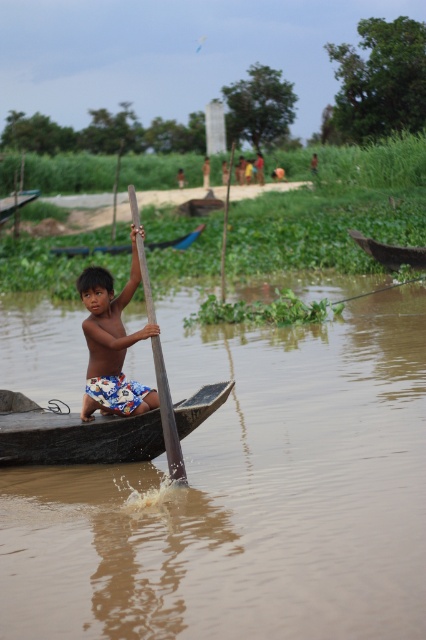
You are a passenger in the brown wooden boat at center and dark brown wood canoe at center. Which vessel is currently above the other?

The brown wooden boat at center is positioned over dark brown wood canoe at center, so the brown wooden boat at center is above the dark brown wood canoe at center.

You are a photographer trying to capture the boy in the shiny blue shorts at center and the brown wooden boat at right. If you want to frame both subjects so that the shorts and the boat are visible in the same shot, which subject should you position closer to the edge of the frame to avoid overcrowding?

Since the shiny blue shorts at center is narrower than the brown wooden boat at right, you should position the brown wooden boat at right closer to the edge of the frame to avoid overcrowding while keeping both subjects visible.

You are a photographer trying to capture the shiny blue shorts at center and the brown wooden boat at right in the same frame. Which object should you focus on first to ensure both are in focus?

You should focus on the shiny blue shorts at center first because it is closer to the viewer than the brown wooden boat at right, so adjusting focus from near to far will help both be in focus.